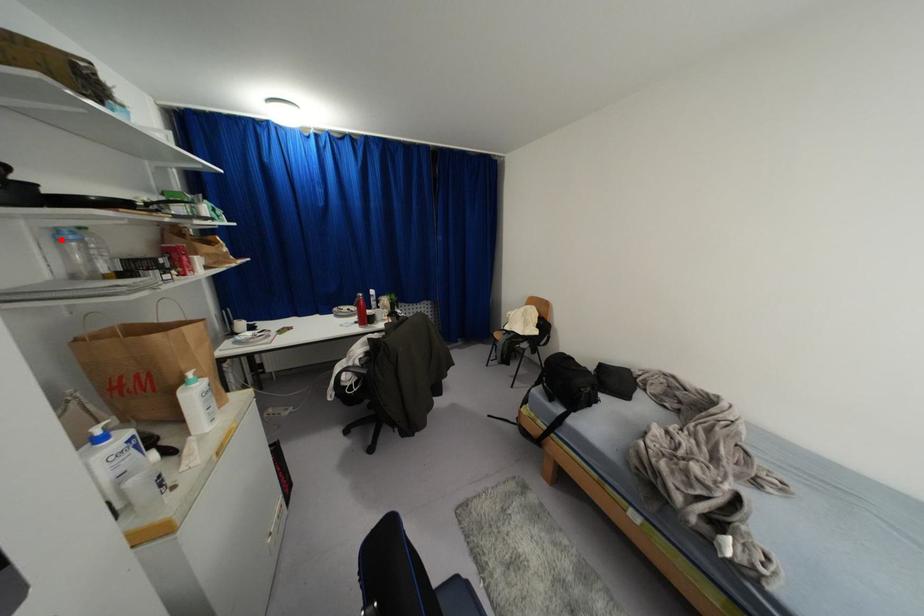
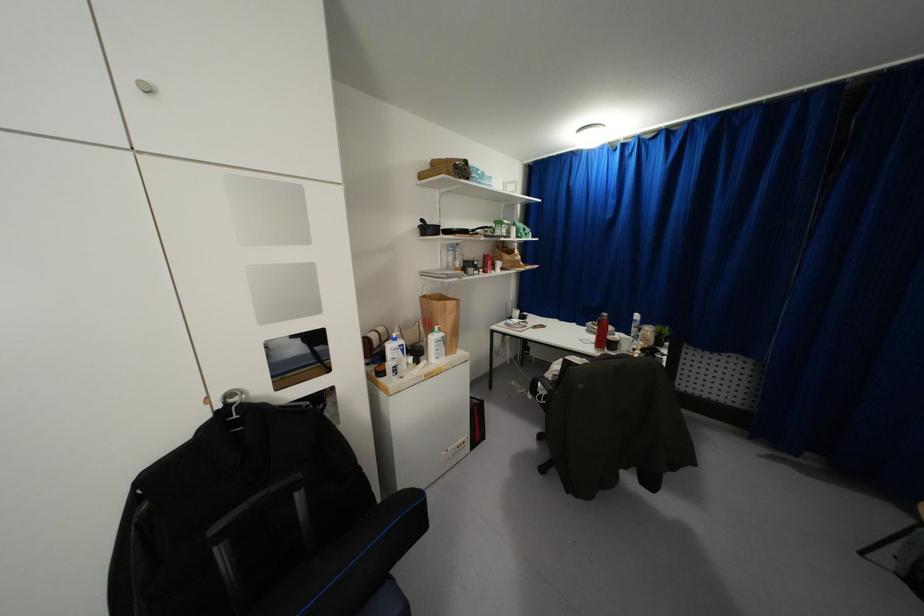
Question: A red point is marked in image1. In image2, is the corresponding 3D point closer to the camera or farther? Reply with the corresponding letter.

Choices:
 (A) The corresponding 3D point is closer.
 (B) The corresponding 3D point is farther.

Answer: (A)